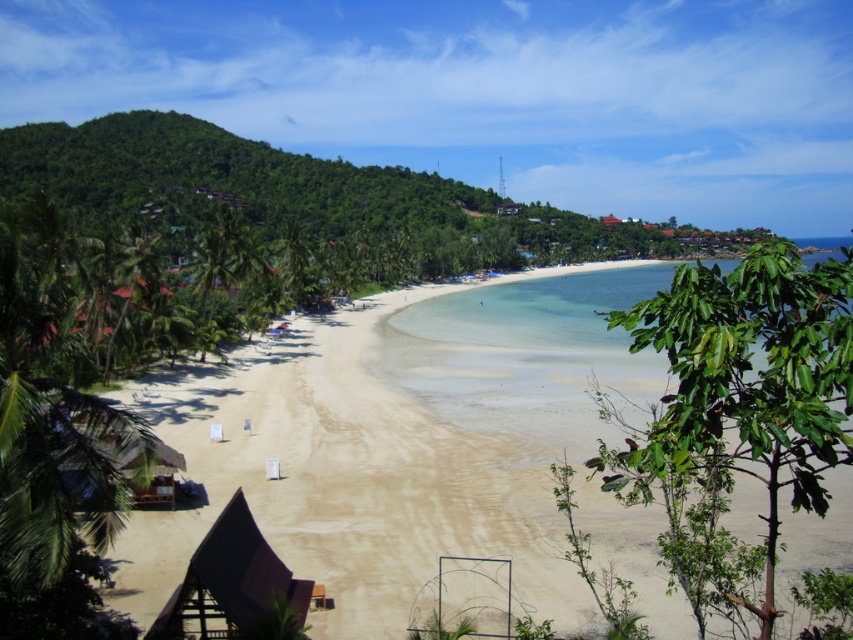
Who is more forward, (473, 358) or (216, 589)?

Point (216, 589) is more forward.

Find the location of a particular element. white sand beach at center is located at coordinates (409, 451).

Is point (494, 480) less distant than point (686, 436)?

No, (494, 480) is behind (686, 436).

Does white sand beach at center have a lesser width compared to green leafy palm tree at right?

No, white sand beach at center is not thinner than green leafy palm tree at right.

What do you see at coordinates (409, 451) in the screenshot?
I see `white sand beach at center` at bounding box center [409, 451].

The image size is (853, 640). I want to click on white sand beach at center, so click(409, 451).

Does point (606, 452) lie behind point (265, 547)?

No, it is in front of (265, 547).

Describe the element at coordinates (737, 413) in the screenshot. The image size is (853, 640). I see `green leafy palm tree at right` at that location.

Where is `green leafy palm tree at right`? This screenshot has height=640, width=853. green leafy palm tree at right is located at coordinates (737, 413).